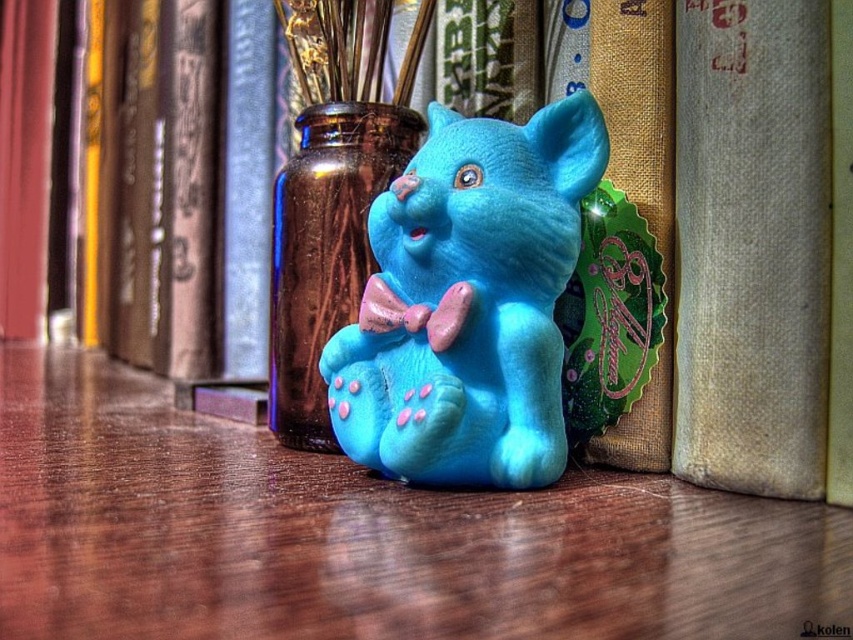
You are organizing a shelf and need to place the matte blue plush cat at center and the beige textured book at center. According to the image, which object is on the left side?

The matte blue plush cat at center is positioned on the left side of the beige textured book at center.

You are organizing a display on a shelf and have a matte wooden table at center and a beige textured book at center. Which object should you place first if you want to ensure there is enough space for both?

Since the matte wooden table at center is larger in size than the beige textured book at center, you should place the matte wooden table at center first to ensure there is enough space for both.